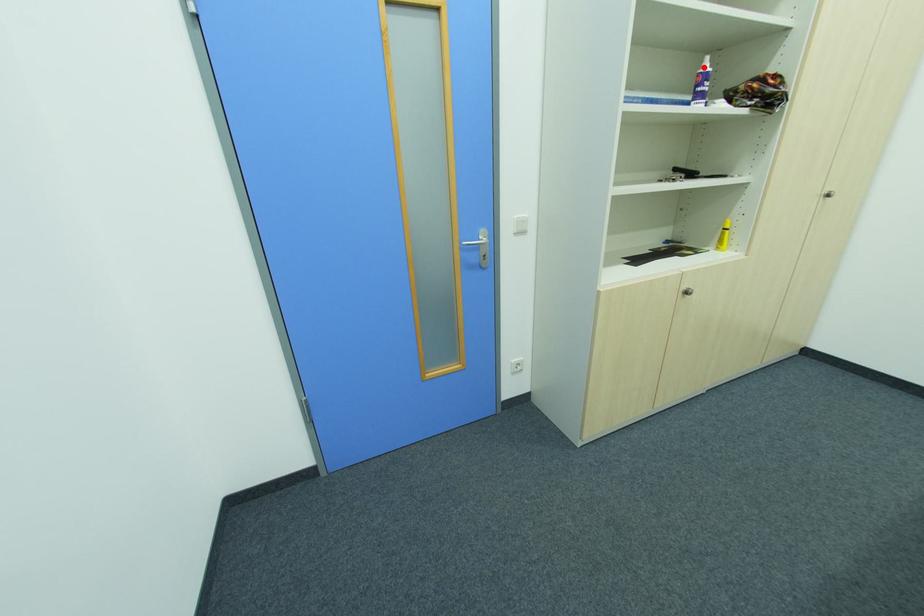
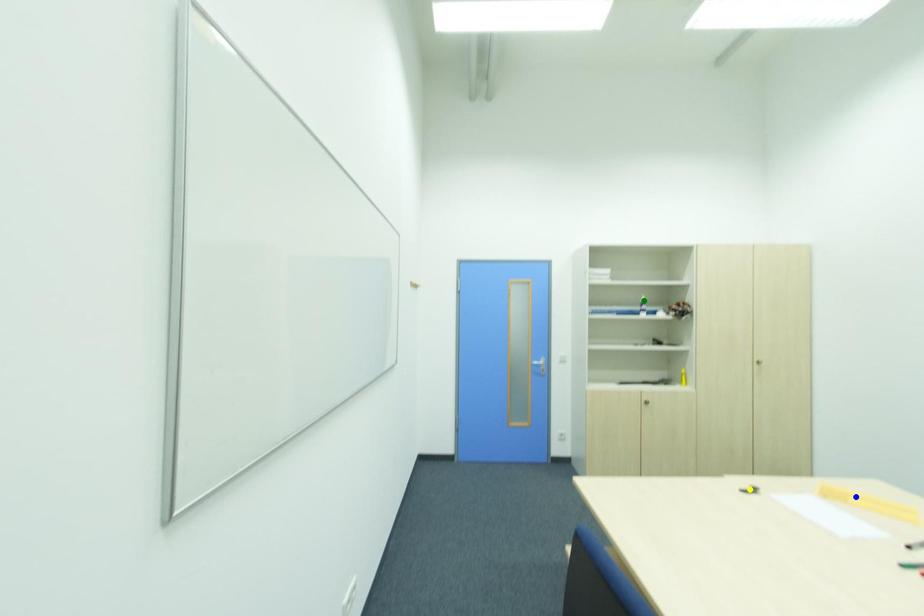
Question: I am providing you with two images of the same scene from different viewpoints. A red point is marked on the first image. You are given multiple points on the second image. Which point in image 2 is actually the same real-world point as the red point in image 1?

Choices:
 (A) blue point
 (B) yellow point
 (C) green point

Answer: (C)